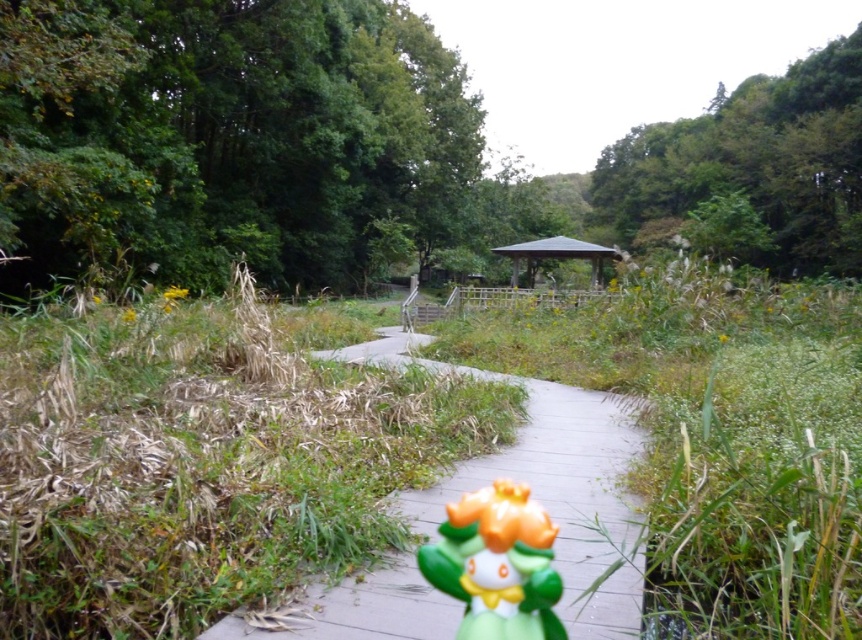
You are a gardener planning to mow the green grass at center and trim the green wooden gazebo at center. Which object requires more attention to avoid damaging it during maintenance?

The green wooden gazebo at center requires more attention to avoid damaging it during maintenance since it is thicker than the green grass at center.

You are a gardener planning to mow the green grass at center and wooden at center. Which area should you mow first if you want to avoid walking on freshly cut grass?

The green grass at center is in front of wooden at center, so you should mow the green grass at center first to avoid walking over it after cutting.

You are standing at the entrance of the wooden pathway in the image. You want to walk straight ahead towards the center of the scene. Will you step onto the green grass at center before reaching the gazebo or pavilion on the right side of the path?

The green grass at center is located at point (203, 467) in the scene. Since the gazebo or pavilion is on the right side of the path and the grass is at the center, walking straight ahead would lead you to the green grass at center before reaching the gazebo or pavilion on the right side.